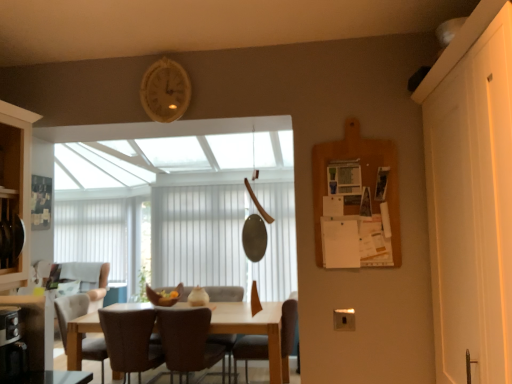
Question: From a real-world perspective, is brown leather chair at center, acting as the 2th chair starting from the right, physically located above or below brown leather chair at center, the first chair positioned from the right?

Choices:
 (A) below
 (B) above

Answer: (B)

Question: Choose the correct answer: Is brown leather chair at center, which is the third chair in left-to-right order, inside brown leather chair at center, which appears as the fourth chair when viewed from the left, or outside it?

Choices:
 (A) outside
 (B) inside

Answer: (A)

Question: Estimate the real-world distances between objects in this image. Which object is closer to the white/textured blind at center?

Choices:
 (A) brown leather chair at center, which is counted as the second chair, starting from the left
 (B) brown leather chair at center, which is the third chair in left-to-right order
 (C) white matte door at right
 (D) wooden bulletin board at right
 (E) brown leather chair at center, the first chair positioned from the right

Answer: (B)

Question: Estimate the real-world distances between objects in this image. Which object is closer to the white matte door at right?

Choices:
 (A) brown leather chair at center, the first chair positioned from the right
 (B) white/textured blind at center
 (C) brown leather chair at lower left, which is counted as the 4th chair, starting from the right
 (D) brown leather armchair at center
 (E) wooden bulletin board at right

Answer: (E)